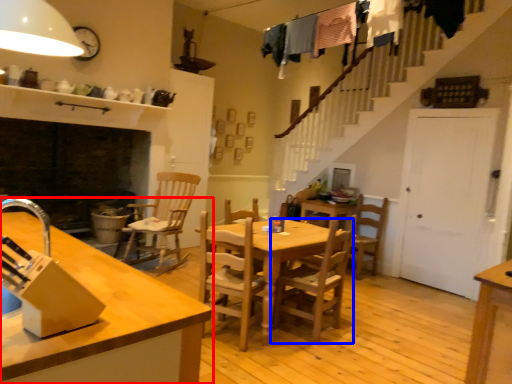
Question: Which of the following is the closest to the observer, countertop (highlighted by a red box) or chair (highlighted by a blue box)?

Choices:
 (A) countertop
 (B) chair

Answer: (A)